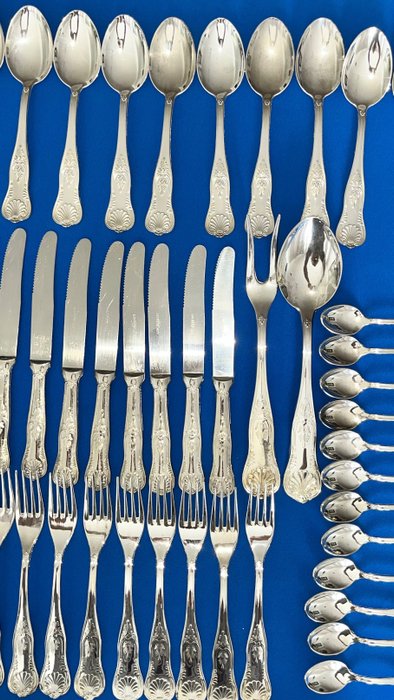
Identify the location of fork. tap(2, 526), tap(27, 535), tap(62, 539), tap(92, 539), tap(127, 542), tap(158, 544), tap(191, 545), tap(220, 546), tap(255, 545), tap(260, 294).